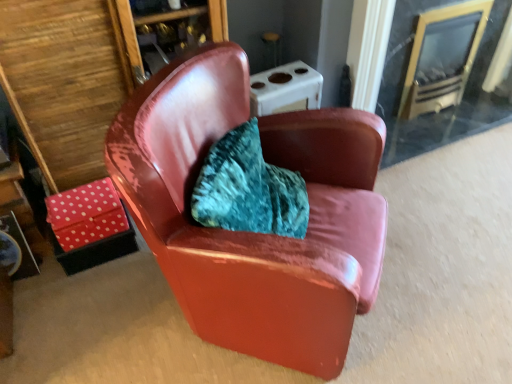
Question: Can we say glossy leather chair at center lies outside clear glass fireplace at upper right?

Choices:
 (A) no
 (B) yes

Answer: (B)

Question: From the image's perspective, is glossy leather chair at center located beneath clear glass fireplace at upper right?

Choices:
 (A) no
 (B) yes

Answer: (B)

Question: From a real-world perspective, does glossy leather chair at center sit lower than clear glass fireplace at upper right?

Choices:
 (A) no
 (B) yes

Answer: (A)

Question: Can you confirm if glossy leather chair at center is positioned to the right of clear glass fireplace at upper right?

Choices:
 (A) yes
 (B) no

Answer: (B)

Question: Is glossy leather chair at center wider than clear glass fireplace at upper right?

Choices:
 (A) yes
 (B) no

Answer: (A)

Question: Is glossy leather chair at center facing towards clear glass fireplace at upper right?

Choices:
 (A) yes
 (B) no

Answer: (B)

Question: From a real-world perspective, is polka dot fabric table at lower left physically above glossy leather chair at center?

Choices:
 (A) no
 (B) yes

Answer: (A)

Question: Can you confirm if polka dot fabric table at lower left is thinner than glossy leather chair at center?

Choices:
 (A) yes
 (B) no

Answer: (A)

Question: Is polka dot fabric table at lower left taller than glossy leather chair at center?

Choices:
 (A) yes
 (B) no

Answer: (B)

Question: Is polka dot fabric table at lower left aimed at glossy leather chair at center?

Choices:
 (A) yes
 (B) no

Answer: (B)

Question: Is polka dot fabric table at lower left smaller than glossy leather chair at center?

Choices:
 (A) no
 (B) yes

Answer: (B)

Question: From the image's perspective, is polka dot fabric table at lower left located above glossy leather chair at center?

Choices:
 (A) no
 (B) yes

Answer: (A)

Question: Is clear glass fireplace at upper right looking in the opposite direction of polka dot fabric table at lower left?

Choices:
 (A) no
 (B) yes

Answer: (A)